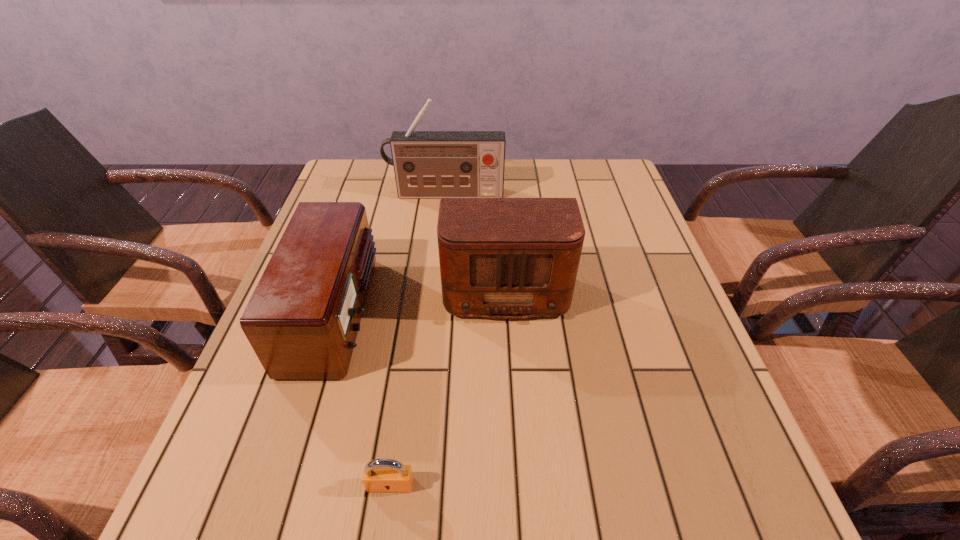
Locate an element on the screen. The height and width of the screenshot is (540, 960). free spot between the farthest object and the second shortest object is located at coordinates pyautogui.click(x=390, y=254).

I want to click on free spot between the second shortest radio receiver and the shortest object, so coord(447,384).

Find the location of a particular element. The height and width of the screenshot is (540, 960). vacant point located between the shortest object and the farthest object is located at coordinates (418, 340).

Where is `unoccupied area between the farthest object and the shortest radio receiver`? The image size is (960, 540). unoccupied area between the farthest object and the shortest radio receiver is located at coordinates 390,254.

Image resolution: width=960 pixels, height=540 pixels. I want to click on vacant space that is in between the farthest object and the third tallest object, so click(390, 254).

Image resolution: width=960 pixels, height=540 pixels. In order to click on free spot between the second shortest radio receiver and the third tallest object in this screenshot , I will do `click(420, 299)`.

Where is `vacant area that lies between the farthest object and the nearest object`? This screenshot has height=540, width=960. vacant area that lies between the farthest object and the nearest object is located at coordinates (418, 340).

Locate an element on the screen. vacant space that is in between the second shortest radio receiver and the shortest object is located at coordinates (447, 384).

Identify the location of the second closest object to the padlock. (499, 257).

Locate an element on the screen. The width and height of the screenshot is (960, 540). object that stands as the closest to the farthest object is located at coordinates (499, 257).